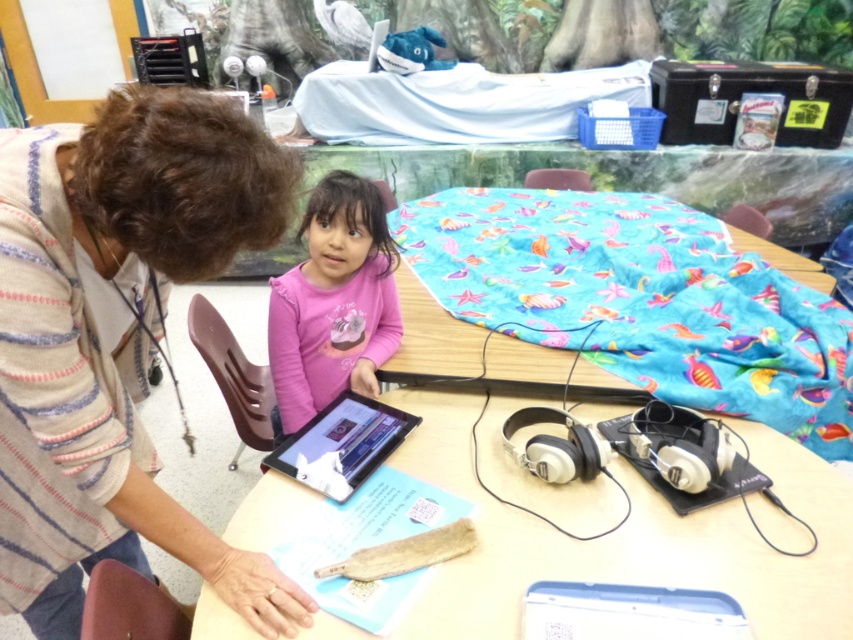
You are a visitor in the room and want to place a 24 inch wide laptop on the table. Can you fit it on the smooth beige table at center or the textured fabric table at center?

The smooth beige table at center and textured fabric table at center are 23.42 inches apart. Since the laptop is 24 inches wide, it cannot fit between them. However, the question is about placing it on the tables, not between them. The description does not provide the dimensions of the tables themselves, so we cannot determine if the laptop will fit on either table individually.

You are organizing a classroom activity and need to place two different tables in the room. The smooth beige table at center and the textured fabric table at center are both available. If you want to choose the narrower table to fit through a narrow doorway, which one should you select?

The smooth beige table at center should be selected because its width is less than the textured fabric table at center, making it narrower and easier to fit through the narrow doorway.

You are a person standing in the room. You see the smooth beige table at center and the pink matte shirt at center. Which object is closer to the floor?

The smooth beige table at center is closer to the floor because it is below the pink matte shirt at center.